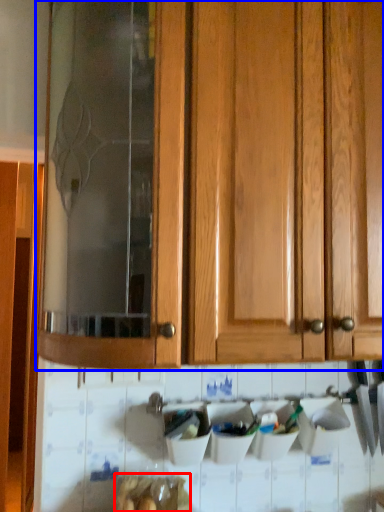
Question: Among these objects, which one is nearest to the camera, food (highlighted by a red box) or cabinetry (highlighted by a blue box)?

Choices:
 (A) food
 (B) cabinetry

Answer: (B)